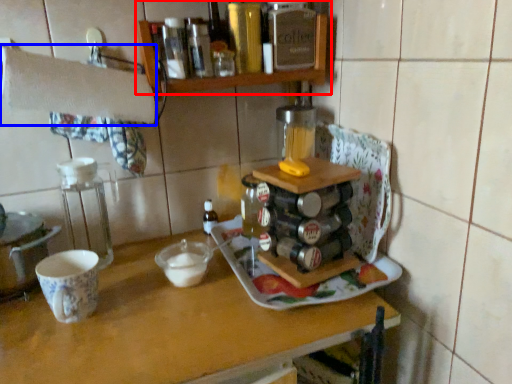
Question: Which of the following is the closest to the observer, shelf (highlighted by a red box) or towel bar (highlighted by a blue box)?

Choices:
 (A) shelf
 (B) towel bar

Answer: (B)